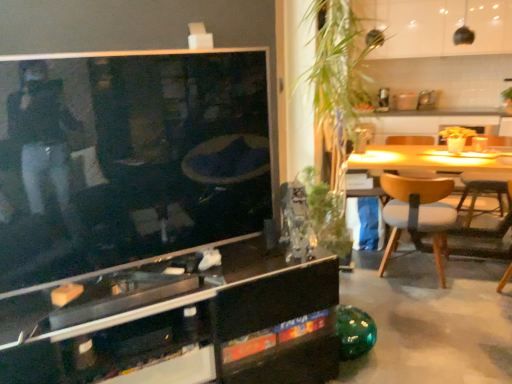
Question: Should I look upward or downward to see black glass cabinet at center?

Choices:
 (A) up
 (B) down

Answer: (B)

Question: Which direction should I rotate to look at green leafy plant at center, which is the 2th plant in bottom-to-top order?

Choices:
 (A) right
 (B) left

Answer: (A)

Question: Is green leafy plant at center, which is the first plant in top-to-bottom order, behind wooden chair at right, marked as the 1th chair in a right-to-left arrangement?

Choices:
 (A) no
 (B) yes

Answer: (A)

Question: Does green leafy plant at center, which is the first plant in top-to-bottom order, come in front of wooden chair at right, placed as the 1th chair when sorted from back to front?

Choices:
 (A) yes
 (B) no

Answer: (A)

Question: Does green leafy plant at center, which is the 2th plant in bottom-to-top order, turn towards wooden chair at right, marked as the 1th chair in a right-to-left arrangement?

Choices:
 (A) no
 (B) yes

Answer: (A)

Question: Is green leafy plant at center, which is the first plant in top-to-bottom order, not close to wooden chair at right, which ranks as the 2th chair in front-to-back order?

Choices:
 (A) yes
 (B) no

Answer: (A)

Question: Is green leafy plant at center, which is the 2th plant in bottom-to-top order, directly adjacent to wooden chair at right, which ranks as the second chair in left-to-right order?

Choices:
 (A) no
 (B) yes

Answer: (A)

Question: Considering the relative positions of green leafy plant at center, which is the 2th plant in bottom-to-top order, and wooden chair at right, marked as the 1th chair in a right-to-left arrangement, in the image provided, is green leafy plant at center, which is the 2th plant in bottom-to-top order, to the left of wooden chair at right, marked as the 1th chair in a right-to-left arrangement, from the viewer's perspective?

Choices:
 (A) yes
 (B) no

Answer: (A)

Question: Is wooden chair at right, which ranks as the 2th chair in front-to-back order, bigger than light brown wood chair at right, placed as the first chair when sorted from left to right?

Choices:
 (A) yes
 (B) no

Answer: (B)

Question: Would you say wooden chair at right, which ranks as the 2th chair in front-to-back order, is a long distance from light brown wood chair at right, acting as the 2th chair starting from the right?

Choices:
 (A) yes
 (B) no

Answer: (B)

Question: Is light brown wood chair at right, acting as the 2th chair starting from the right, inside wooden chair at right, marked as the 1th chair in a right-to-left arrangement?

Choices:
 (A) yes
 (B) no

Answer: (B)

Question: Does wooden chair at right, placed as the 1th chair when sorted from back to front, touch light brown wood chair at right, positioned as the second chair in back-to-front order?

Choices:
 (A) yes
 (B) no

Answer: (B)

Question: Would you say wooden chair at right, placed as the 1th chair when sorted from back to front, is outside light brown wood chair at right, acting as the 2th chair starting from the right?

Choices:
 (A) yes
 (B) no

Answer: (A)

Question: From the image's perspective, is wooden chair at right, which ranks as the second chair in left-to-right order, on light brown wood chair at right, placed as the first chair when sorted from left to right?

Choices:
 (A) no
 (B) yes

Answer: (B)

Question: Is green glass vase at center, marked as the 2th plant in a top-to-bottom arrangement, turned away from black glass cabinet at center?

Choices:
 (A) yes
 (B) no

Answer: (B)